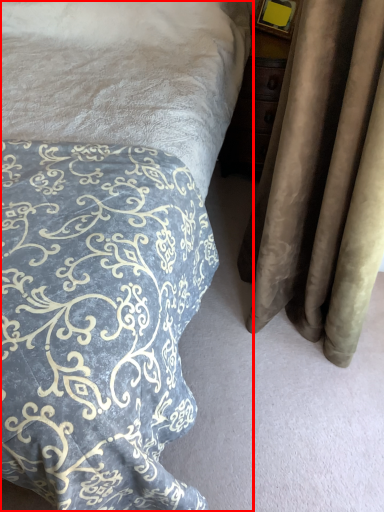
Question: From the image's perspective, what is the correct spatial positioning of bed (annotated by the red box) in reference to curtain?

Choices:
 (A) below
 (B) above

Answer: (A)